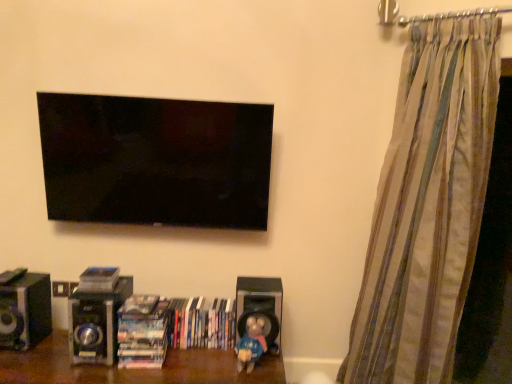
Where is `vacant area that is in front of matte plastic book at lower center, the third book viewed from the right`? The height and width of the screenshot is (384, 512). vacant area that is in front of matte plastic book at lower center, the third book viewed from the right is located at coordinates (91, 297).